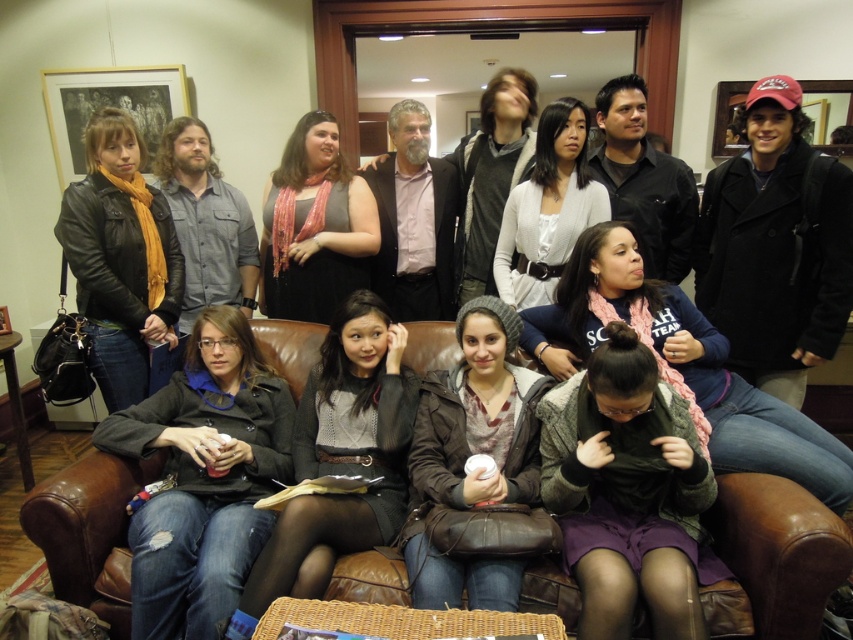
Who is positioned more to the right, brown leather couch at lower center or knitted gray beanie at center?

From the viewer's perspective, brown leather couch at lower center appears more on the right side.

Image resolution: width=853 pixels, height=640 pixels. I want to click on brown leather couch at lower center, so click(x=779, y=552).

Is point (285, 371) positioned behind point (415, 454)?

Yes, point (285, 371) is behind point (415, 454).

Locate an element on the screen. The width and height of the screenshot is (853, 640). brown leather couch at lower center is located at coordinates (779, 552).

Is pink scarf at center thinner than matte black dress at center?

In fact, pink scarf at center might be wider than matte black dress at center.

Does point (682, 381) come closer to viewer compared to point (340, 173)?

Yes, it is.

The height and width of the screenshot is (640, 853). Find the location of `pink scarf at center`. pink scarf at center is located at coordinates (683, 365).

What do you see at coordinates (479, 417) in the screenshot?
I see `knitted gray beanie at center` at bounding box center [479, 417].

Can you confirm if knitted gray beanie at center is positioned below matte black dress at center?

Indeed, knitted gray beanie at center is positioned under matte black dress at center.

Identify the location of knitted gray beanie at center. (479, 417).